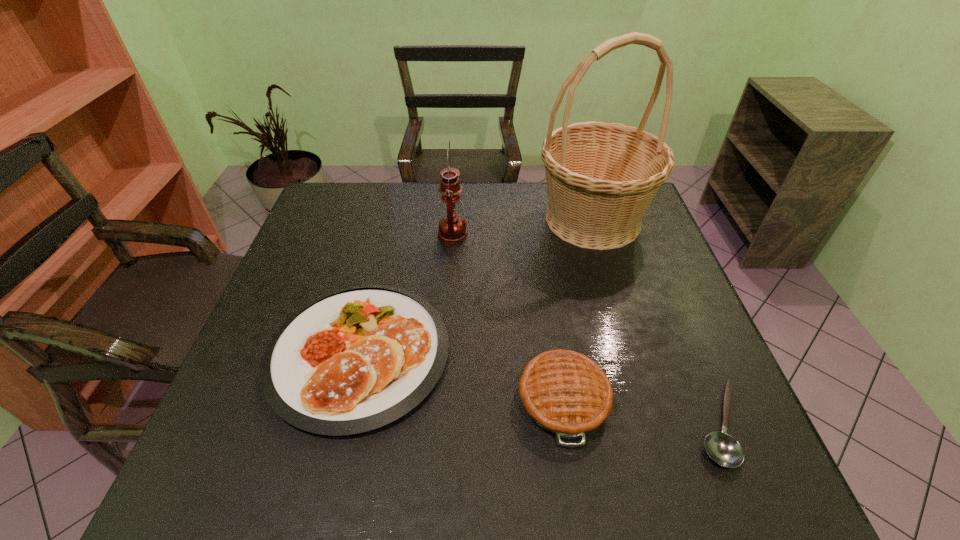
The height and width of the screenshot is (540, 960). I want to click on free location at the left edge, so click(258, 351).

At what (x,y) coordinates should I click in order to perform the action: click on vacant area at the right edge of the desktop. Please return your answer as a coordinate pair (x, y). This screenshot has height=540, width=960. Looking at the image, I should click on (685, 313).

Find the location of a particular element. The width and height of the screenshot is (960, 540). vacant space at the far left corner is located at coordinates (315, 214).

In the image, there is a desktop. Where is `vacant space at the near right corner`? Image resolution: width=960 pixels, height=540 pixels. vacant space at the near right corner is located at coordinates (694, 487).

In order to click on free space between the tallest object and the pie in this screenshot , I will do [578, 309].

At what (x,y) coordinates should I click in order to perform the action: click on vacant space that is in between the basket and the shortest object. Please return your answer as a coordinate pair (x, y). This screenshot has width=960, height=540. Looking at the image, I should click on (656, 321).

Identify the location of vacant area between the basket and the dish. (475, 286).

At what (x,y) coordinates should I click in order to perform the action: click on vacant point located between the tallest object and the oil lamp. Please return your answer as a coordinate pair (x, y). Looking at the image, I should click on 522,227.

At what (x,y) coordinates should I click in order to perform the action: click on free spot between the tallest object and the dish. Please return your answer as a coordinate pair (x, y). Looking at the image, I should click on (475, 286).

Where is `unoccupied position between the oil lamp and the third shortest object`? unoccupied position between the oil lamp and the third shortest object is located at coordinates (508, 317).